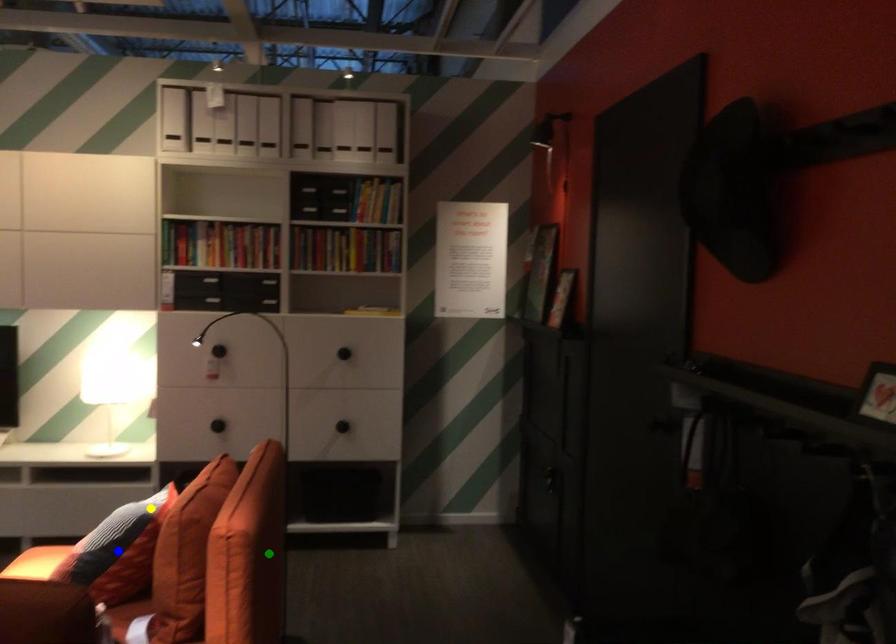
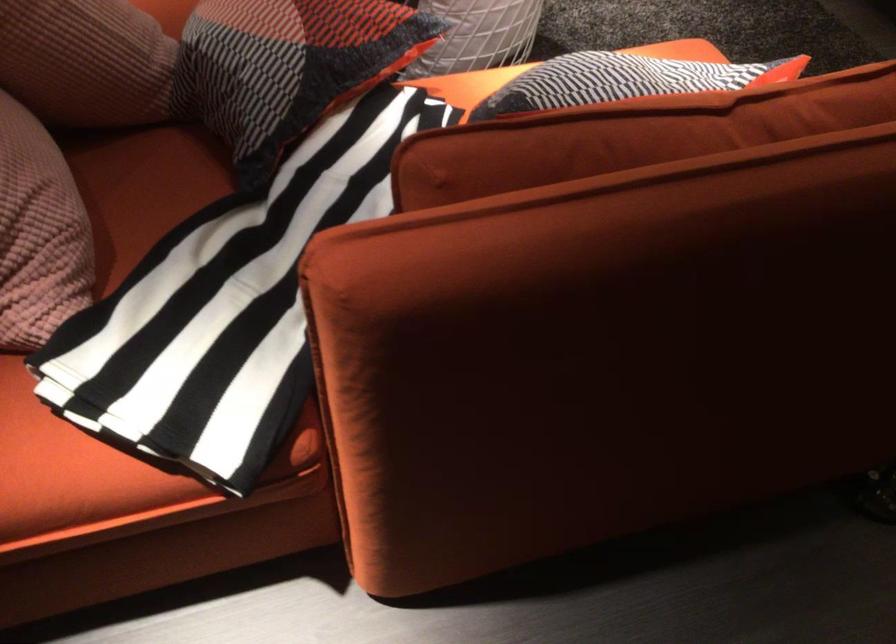
I am providing you with two images of the same scene from different viewpoints. Three points are marked in image1. Which point corresponds to a part or object that is occluded in image2?In image1, three points are marked. Which of them correspond to a part or object that is occluded in image2?Among the three points shown in image1, which one corresponds to a part or object that is no longer visible due to occlusion in image2?

blue point